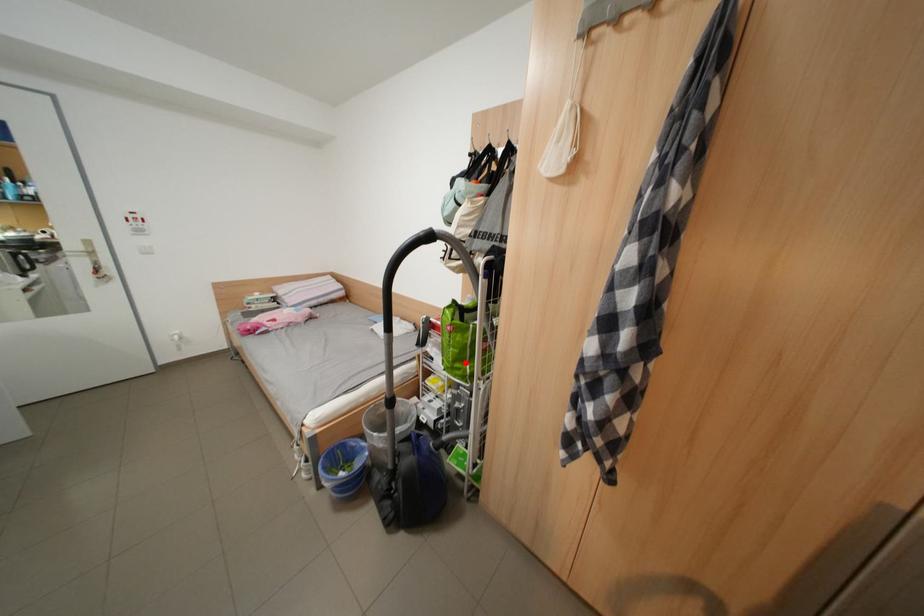
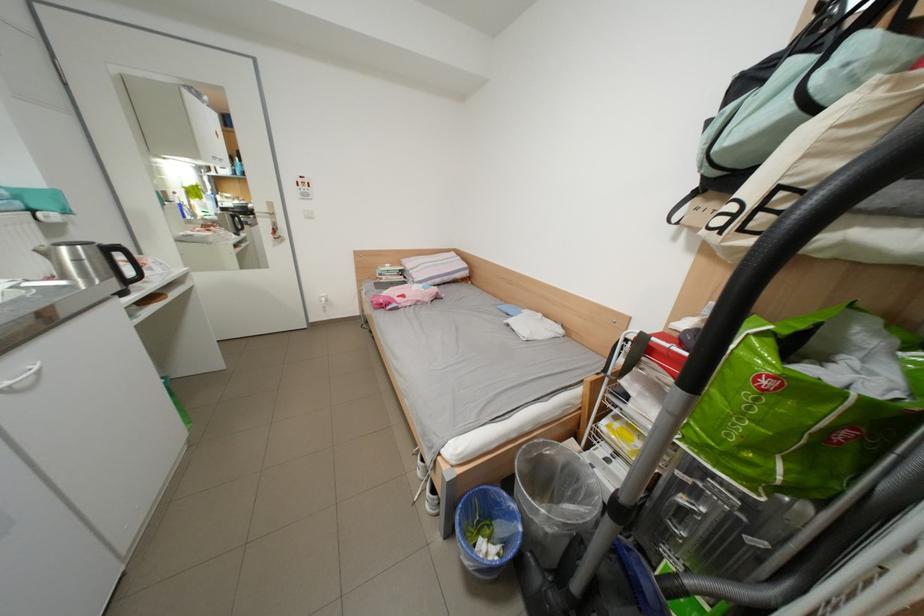
Find the pixel in the second image that matches the highlighted location in the first image.

(754, 448)